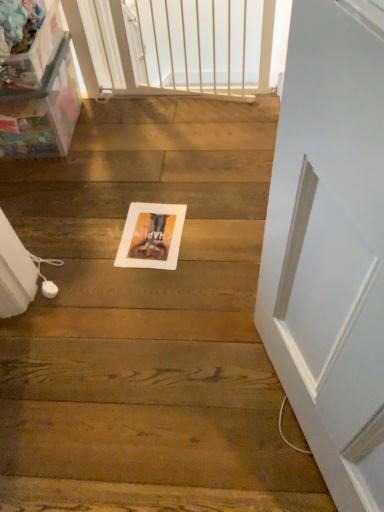
Question: From the image's perspective, is white paper postcard at center above or below white matte screen door at upper center?

Choices:
 (A) below
 (B) above

Answer: (A)

Question: Relative to white matte screen door at upper center, is white paper postcard at center in front or behind?

Choices:
 (A) behind
 (B) front

Answer: (B)

Question: Is white paper postcard at center inside the boundaries of white matte screen door at upper center, or outside?

Choices:
 (A) outside
 (B) inside

Answer: (A)

Question: Based on their sizes in the image, would you say white matte screen door at upper center is bigger or smaller than white paper postcard at center?

Choices:
 (A) big
 (B) small

Answer: (A)

Question: From the image's perspective, relative to white paper postcard at center, is white matte screen door at upper center above or below?

Choices:
 (A) above
 (B) below

Answer: (A)

Question: Is white matte screen door at upper center wider or thinner than white paper postcard at center?

Choices:
 (A) wide
 (B) thin

Answer: (B)

Question: Does point (266, 46) appear closer or farther from the camera than point (170, 225)?

Choices:
 (A) closer
 (B) farther

Answer: (B)